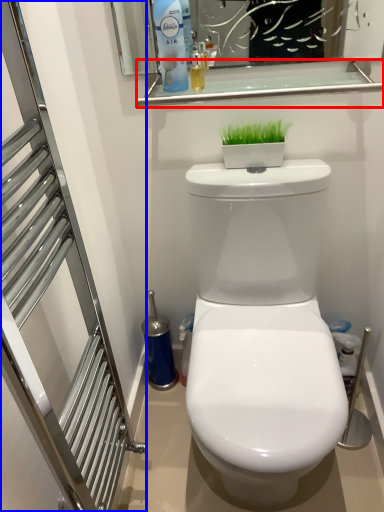
Question: Which of the following is the farthest to the observer, balustrade (highlighted by a red box) or screen door (highlighted by a blue box)?

Choices:
 (A) balustrade
 (B) screen door

Answer: (A)